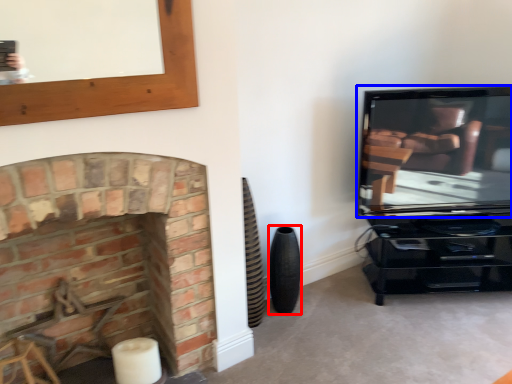
Question: Which object appears farthest to the camera in this image, speaker (highlighted by a red box) or television (highlighted by a blue box)?

Choices:
 (A) speaker
 (B) television

Answer: (A)